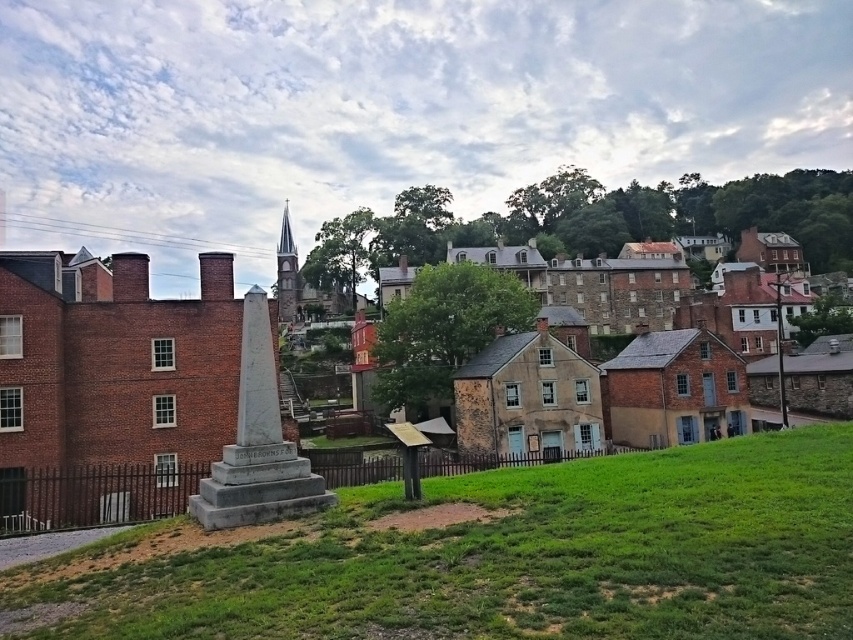
Who is lower down, gray stone monument at center or brick chimney at upper left?

gray stone monument at center is lower down.

Does gray stone monument at center come in front of brick chimney at upper left?

Yes, gray stone monument at center is in front of brick chimney at upper left.

I want to click on gray stone monument at center, so click(x=94, y=493).

Can you confirm if gray stone monument at center is positioned to the right of smooth gray stone steeple at upper center?

Yes, gray stone monument at center is to the right of smooth gray stone steeple at upper center.

Which of these two, gray stone monument at center or smooth gray stone steeple at upper center, stands taller?

With more height is smooth gray stone steeple at upper center.

From the picture: Measure the distance between gray stone monument at center and camera.

A distance of 11.98 meters exists between gray stone monument at center and camera.

Where is `gray stone monument at center`? The height and width of the screenshot is (640, 853). gray stone monument at center is located at coordinates [x=94, y=493].

Who is higher up, smooth gray stone steeple at upper center or brick chimney at upper left?

smooth gray stone steeple at upper center is above.

Does smooth gray stone steeple at upper center lie behind brick chimney at upper left?

Yes, it is.

Locate an element on the screen. Image resolution: width=853 pixels, height=640 pixels. smooth gray stone steeple at upper center is located at coordinates (287, 273).